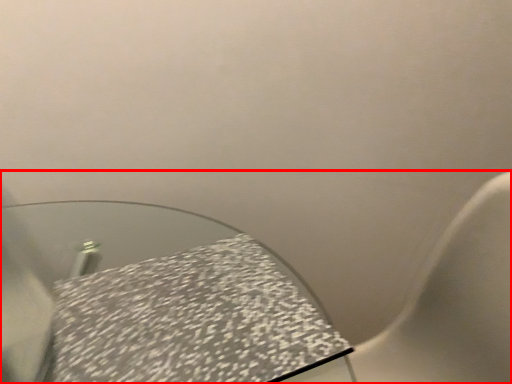
Question: From the image, what is the correct spatial relationship of toilet (annotated by the red box) in relation to tablecloth?

Choices:
 (A) left
 (B) right

Answer: (B)